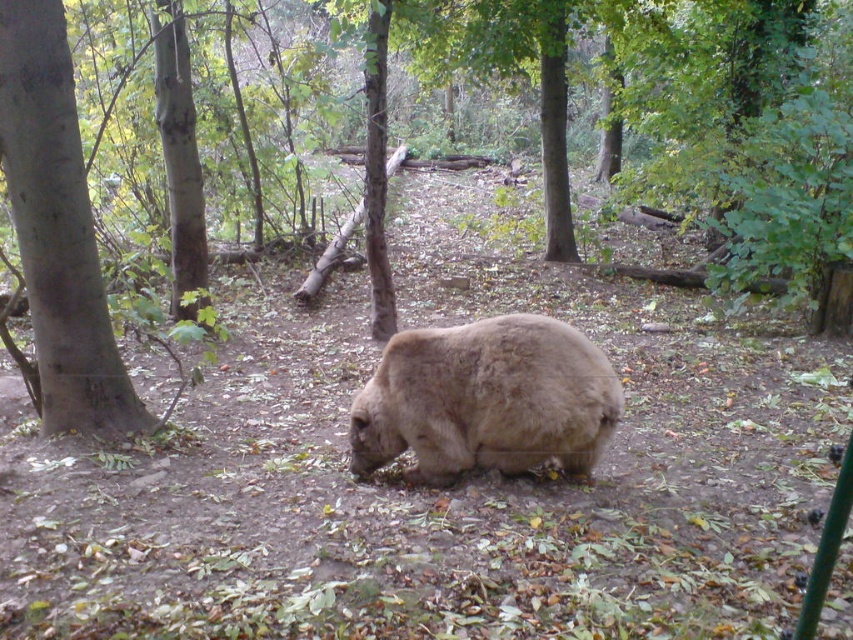
Question: Is the position of fuzzy brown bear at center more distant than that of brown furry bear at center?

Choices:
 (A) no
 (B) yes

Answer: (A)

Question: Which point is farther to the camera?

Choices:
 (A) brown rough tree at left
 (B) fuzzy brown bear at center
 (C) brown furry bear at center

Answer: (C)

Question: Estimate the real-world distances between objects in this image. Which object is farther from the fuzzy brown bear at center?

Choices:
 (A) brown furry bear at center
 (B) brown rough tree at left

Answer: (A)

Question: In this image, where is brown rough tree at left located relative to brown furry bear at center?

Choices:
 (A) below
 (B) above

Answer: (A)

Question: Can you confirm if fuzzy brown bear at center is smaller than brown furry bear at center?

Choices:
 (A) no
 (B) yes

Answer: (A)

Question: Estimate the real-world distances between objects in this image. Which object is closer to the fuzzy brown bear at center?

Choices:
 (A) brown furry bear at center
 (B) brown rough tree at left

Answer: (B)